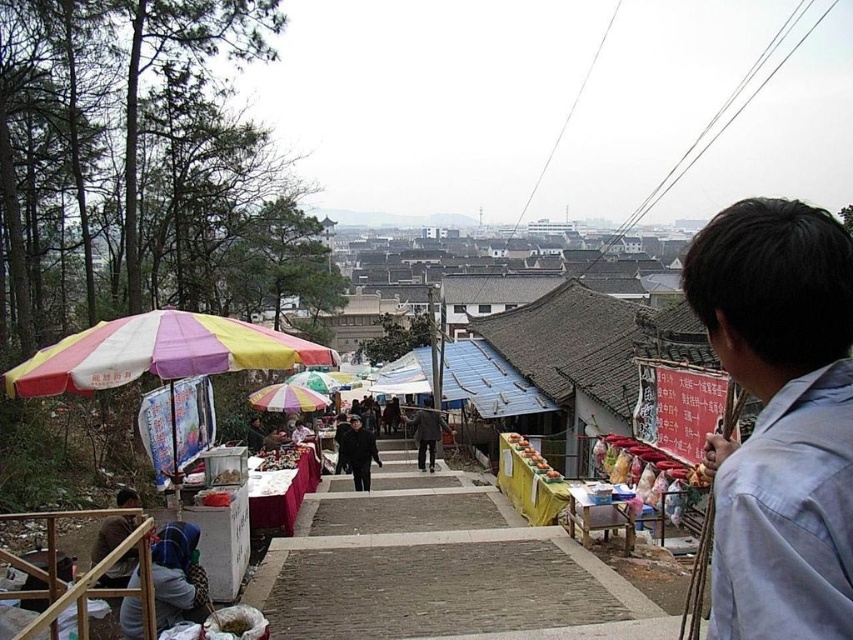
Question: Is dark gray fabric coat at center below dark gray coat at center?

Choices:
 (A) yes
 (B) no

Answer: (B)

Question: Can you confirm if concrete steps at center is wider than dark gray coat at center?

Choices:
 (A) no
 (B) yes

Answer: (B)

Question: Does concrete steps at center appear over rainbow striped fabric umbrella at center?

Choices:
 (A) yes
 (B) no

Answer: (B)

Question: Which point appears closest to the camera in this image?

Choices:
 (A) (386, 493)
 (B) (326, 406)
 (C) (257, 346)
 (D) (740, 540)

Answer: (D)

Question: Which point is closer to the camera?

Choices:
 (A) dark gray fabric coat at center
 (B) dark gray coat at center

Answer: (A)

Question: Considering the real-world distances, which object is farthest from the dark gray fabric coat at center?

Choices:
 (A) concrete steps at center
 (B) dark gray coat at center

Answer: (B)